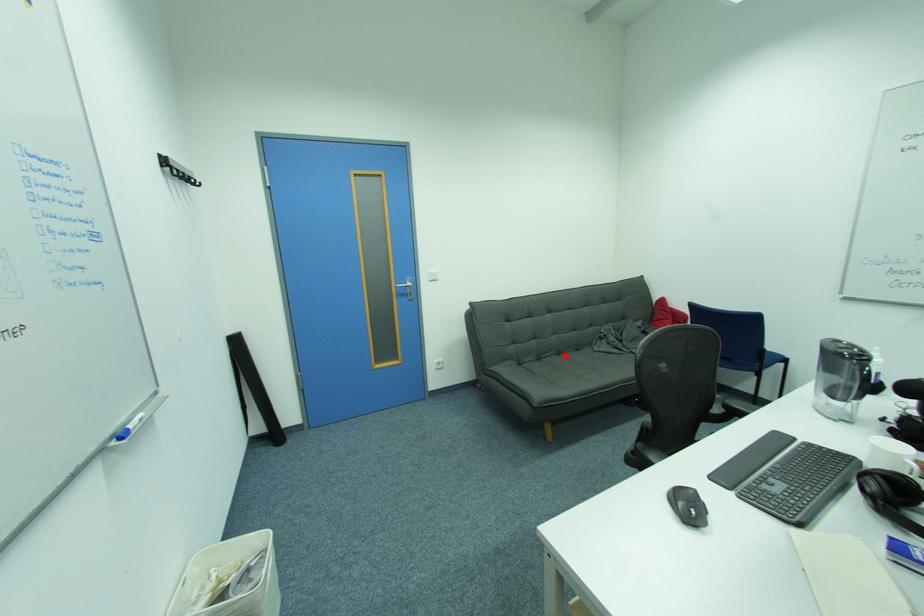
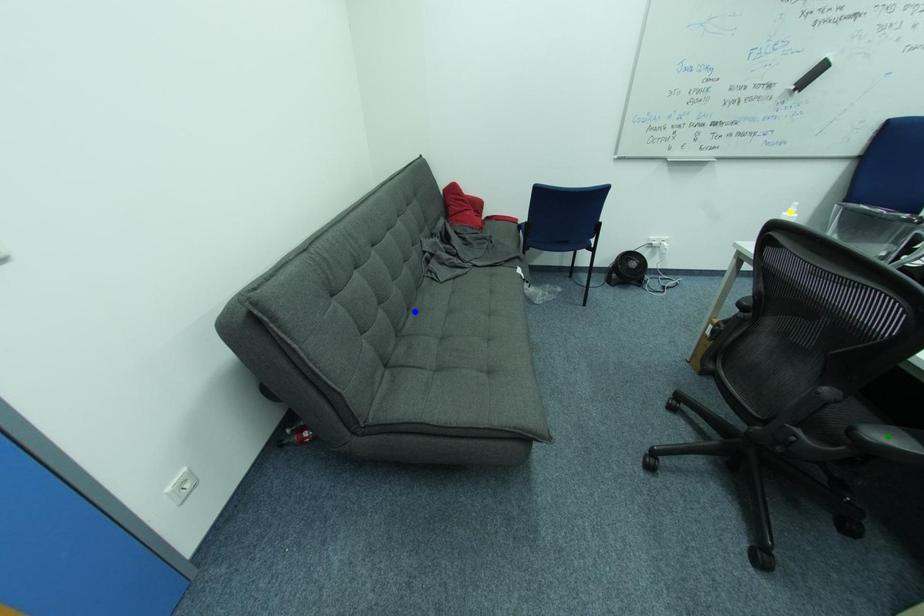
Question: I am providing you with two images of the same scene from different viewpoints. A red point is marked on the first image. You are given multiple points on the second image. Which point in image 2 represents the same 3d spot as the red point in image 1?

Choices:
 (A) green point
 (B) blue point
 (C) yellow point

Answer: (B)